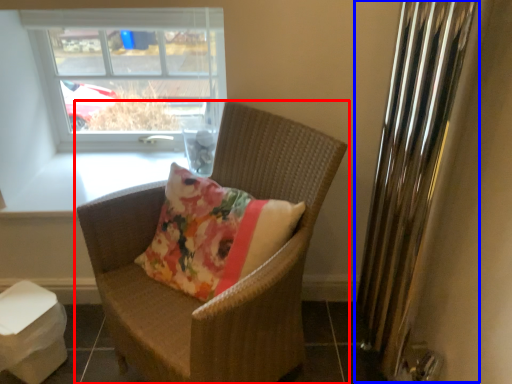
Question: Which object appears closest to the camera in this image, chair (highlighted by a red box) or radiator (highlighted by a blue box)?

Choices:
 (A) chair
 (B) radiator

Answer: (B)